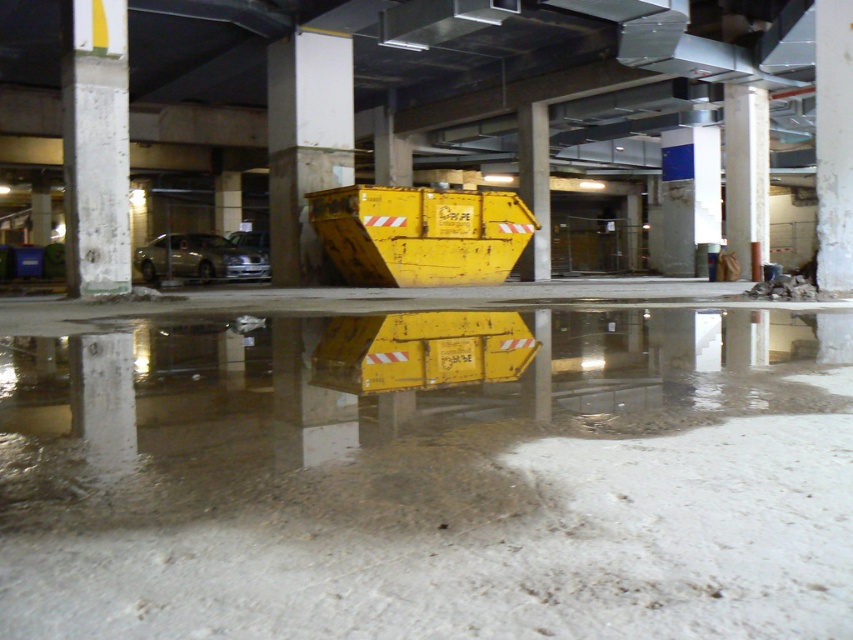
Question: Does white concrete pillar at center have a greater width compared to concrete at center?

Choices:
 (A) yes
 (B) no

Answer: (A)

Question: Is the position of white concrete pillar at left less distant than that of concrete at center?

Choices:
 (A) yes
 (B) no

Answer: (A)

Question: Which point is farther to the camera?

Choices:
 (A) pyautogui.click(x=729, y=115)
 (B) pyautogui.click(x=86, y=481)
 (C) pyautogui.click(x=78, y=83)

Answer: (A)

Question: Estimate the real-world distances between objects in this image. Which object is farther from the white concrete pillar at center?

Choices:
 (A) concrete at center
 (B) yellow metallic dumpster at center
 (C) white concrete pillar at left

Answer: (B)

Question: Does yellow metallic dumpster at center have a larger size compared to concrete at center?

Choices:
 (A) no
 (B) yes

Answer: (A)

Question: Which object is farther from the camera taking this photo?

Choices:
 (A) white concrete pillar at left
 (B) concrete at center
 (C) yellow metallic dumpster at center

Answer: (B)